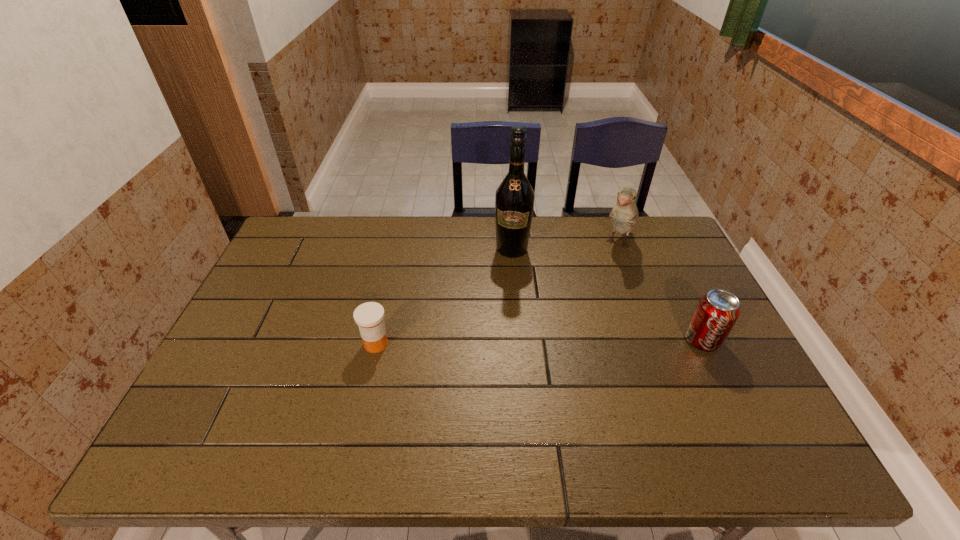
Locate an element on the screen. object positioned at the far right corner is located at coordinates (624, 215).

At what (x,y) coordinates should I click in order to perform the action: click on vacant space at the far edge of the desktop. Please return your answer as a coordinate pair (x, y). Image resolution: width=960 pixels, height=540 pixels. Looking at the image, I should click on (481, 221).

In the image, there is a desktop. Identify the location of blank space at the near edge. (689, 389).

Find the location of a particular element. vacant space at the right edge of the desktop is located at coordinates (698, 352).

The image size is (960, 540). Identify the location of vacant space at the far left corner of the desktop. (299, 227).

Find the location of a particular element. vacant region at the far right corner is located at coordinates (665, 229).

Where is `free space at the near right corner of the desktop`? Image resolution: width=960 pixels, height=540 pixels. free space at the near right corner of the desktop is located at coordinates tap(746, 394).

Image resolution: width=960 pixels, height=540 pixels. What are the coordinates of `free area in between the shortest object and the third shortest object` in the screenshot? It's located at (497, 294).

You are a GUI agent. You are given a task and a screenshot of the screen. Output one action in this format:
    pyautogui.click(x=<x>, y=<y>)
    Task: Click on the vacant point located between the second object from right to left and the leftmost object
    
    Given the screenshot: What is the action you would take?
    pyautogui.click(x=497, y=294)

This screenshot has width=960, height=540. What are the coordinates of `free space between the second shortest object and the third shortest object` in the screenshot? It's located at (660, 292).